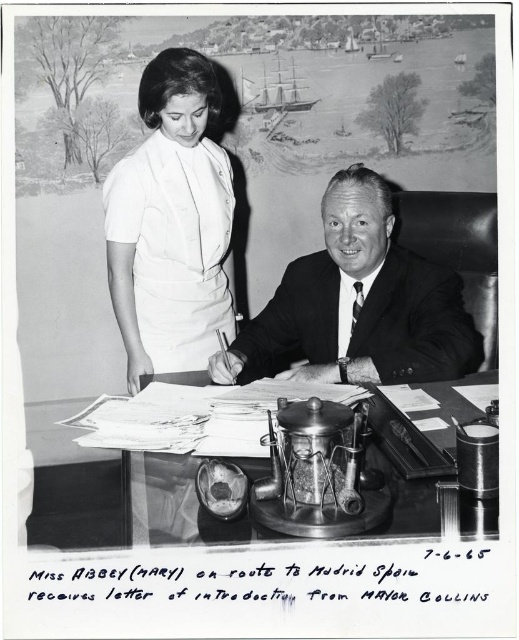
Describe the element at coordinates (171, 224) in the screenshot. This screenshot has height=640, width=519. I see `white fabric dress at upper left` at that location.

Between white fabric dress at upper left and metallic desk at center, which one has more height?

white fabric dress at upper left is taller.

Who is more distant from viewer, (193, 368) or (434, 438)?

The point (193, 368) is more distant.

The width and height of the screenshot is (519, 640). In order to click on white fabric dress at upper left in this screenshot , I will do `click(171, 224)`.

Is smooth black suit at center smaller than metallic desk at center?

Indeed, smooth black suit at center has a smaller size compared to metallic desk at center.

Is smooth black suit at center bigger than metallic desk at center?

Actually, smooth black suit at center might be smaller than metallic desk at center.

Is point (360, 324) closer to viewer compared to point (425, 484)?

No.

At what (x,y) coordinates should I click in order to perform the action: click on smooth black suit at center. Please return your answer as a coordinate pair (x, y). Image resolution: width=519 pixels, height=640 pixels. Looking at the image, I should click on (353, 304).

Is white fabric dress at upper left to the left of smooth black suit at center from the viewer's perspective?

Correct, you'll find white fabric dress at upper left to the left of smooth black suit at center.

Is white fabric dress at upper left bigger than smooth black suit at center?

Indeed, white fabric dress at upper left has a larger size compared to smooth black suit at center.

Is point (192, 195) positioned behind point (285, 333)?

Yes, it is behind point (285, 333).

What are the coordinates of `white fabric dress at upper left` in the screenshot? It's located at (171, 224).